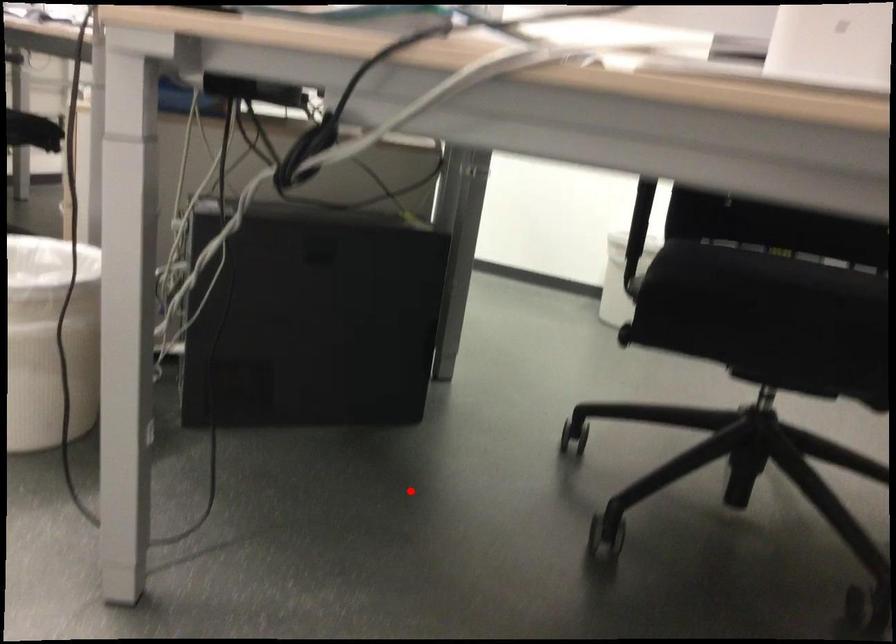
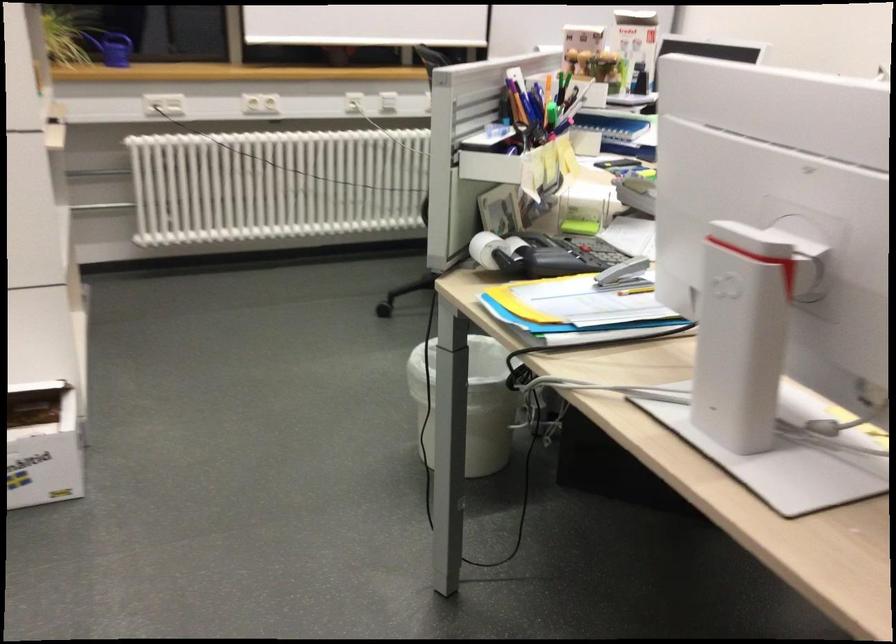
The point at the highlighted location is marked in the first image. Where is the corresponding point in the second image?

(662, 574)